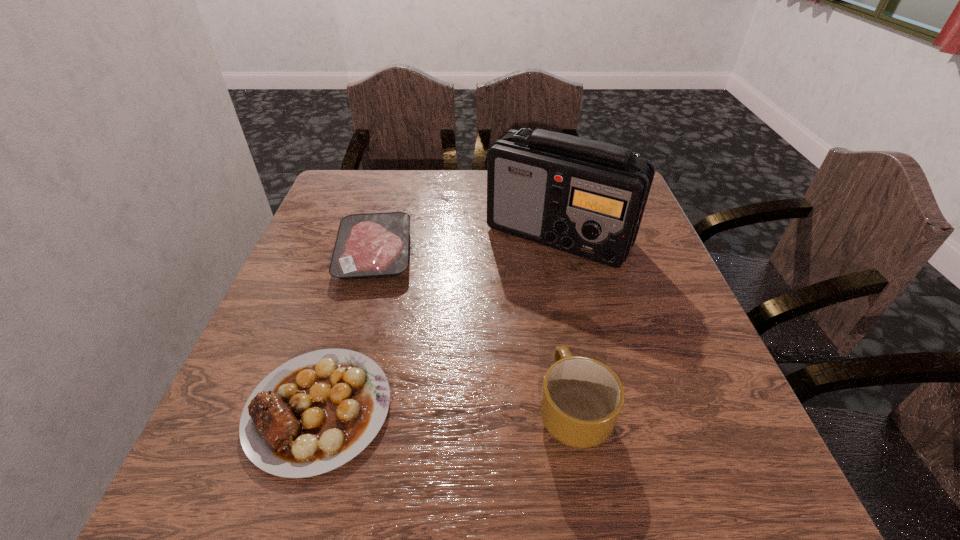
Identify the location of free space between the tallest object and the farther steak. (467, 244).

Find the location of `vacant region between the mug and the tallest object`. vacant region between the mug and the tallest object is located at coordinates (565, 322).

The height and width of the screenshot is (540, 960). Identify the location of free space between the shortest object and the radio receiver. (467, 244).

This screenshot has height=540, width=960. I want to click on vacant space that's between the radio receiver and the taller steak, so click(439, 322).

At what (x,y) coordinates should I click in order to perform the action: click on the second closest object to the mug. Please return your answer as a coordinate pair (x, y). Looking at the image, I should click on (584, 197).

Where is `object that stands as the second closest to the mug`? The width and height of the screenshot is (960, 540). object that stands as the second closest to the mug is located at coordinates (584, 197).

What are the coordinates of `free region that satisfies the following two spatial constraints: 1. on the back side of the nearer steak; 2. on the right side of the shortest object` in the screenshot? It's located at (367, 253).

Identify the location of vacant space that satisfies the following two spatial constraints: 1. on the back side of the second shortest object; 2. on the left side of the shorter steak. (367, 253).